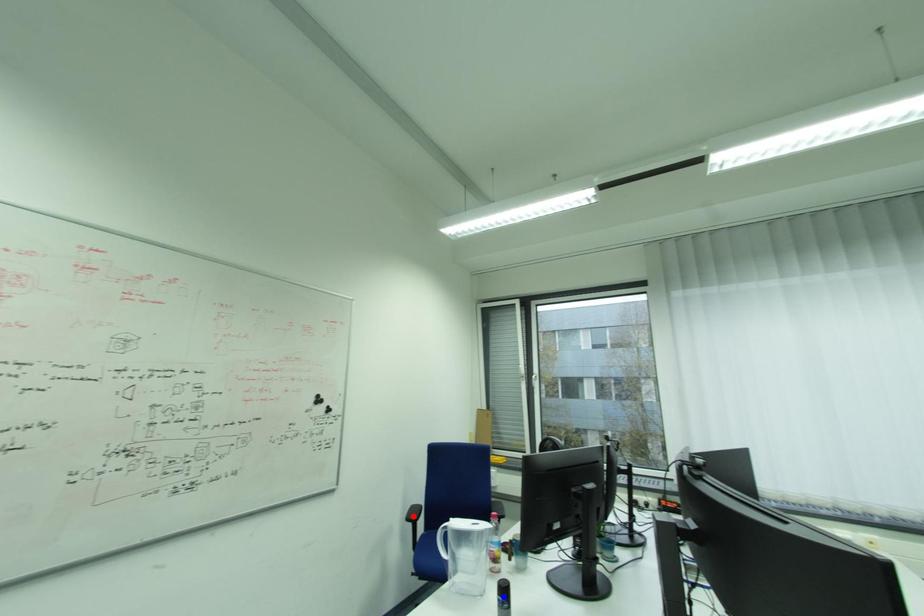
Question: Two points are marked on the image. Which point is closer to the camera?

Choices:
 (A) Blue point is closer.
 (B) Red point is closer.

Answer: (A)